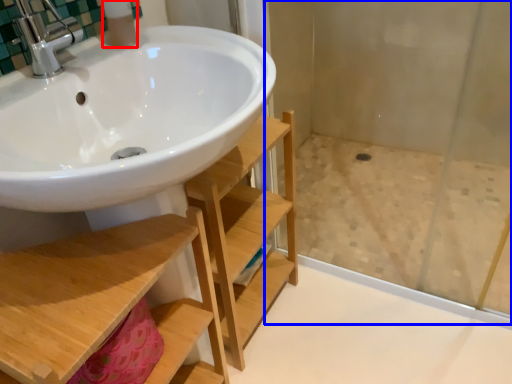
Question: Which object is closer to the camera taking this photo, toiletry (highlighted by a red box) or shower door (highlighted by a blue box)?

Choices:
 (A) toiletry
 (B) shower door

Answer: (A)